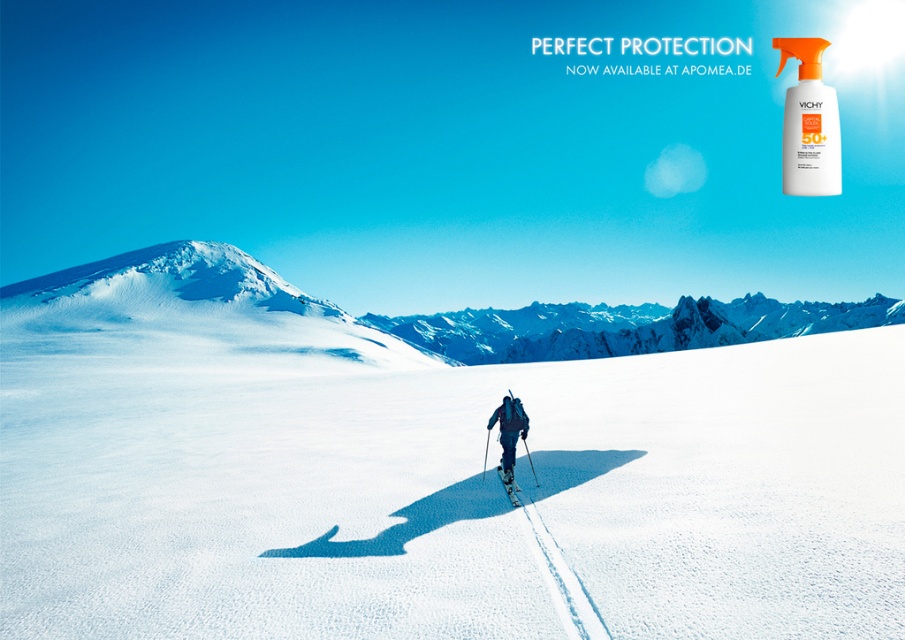
Question: In this image, where is dark blue ski suit at center located relative to shiny blue ski at center?

Choices:
 (A) below
 (B) above

Answer: (B)

Question: Does white powder snow at center lie behind dark blue ski suit at center?

Choices:
 (A) no
 (B) yes

Answer: (A)

Question: Does white powder snow at center appear over white snow-covered mountain at center?

Choices:
 (A) no
 (B) yes

Answer: (A)

Question: Which of the following is the farthest from the observer?

Choices:
 (A) (92, 260)
 (B) (646, 481)
 (C) (503, 413)

Answer: (A)

Question: Which point is farther from the camera taking this photo?

Choices:
 (A) (812, 557)
 (B) (634, 337)
 (C) (818, 77)
 (D) (511, 492)

Answer: (B)

Question: Which of the following is the farthest from the observer?

Choices:
 (A) dark blue ski suit at center
 (B) white plastic spray bottle at upper right
 (C) white powder snow at center

Answer: (B)